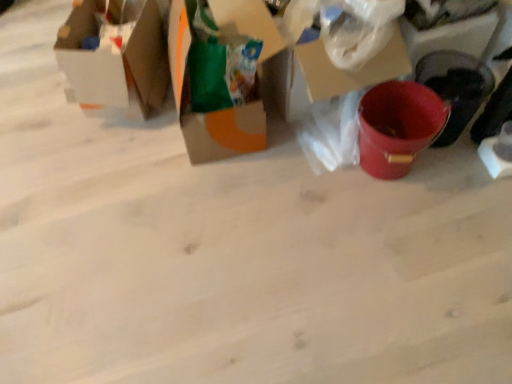
This screenshot has width=512, height=384. I want to click on vacant space that is to the left of matte cardboard box at upper left, which ranks as the second box in right-to-left order, so click(35, 93).